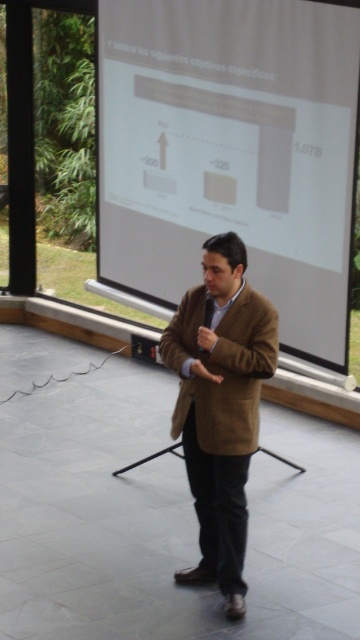
Question: Does white matte projection screen at center have a lesser width compared to brown woolen coat at center?

Choices:
 (A) yes
 (B) no

Answer: (B)

Question: Which of the following is the farthest from the observer?

Choices:
 (A) (249, 324)
 (B) (240, 378)
 (C) (198, 115)

Answer: (C)

Question: Is brown woolen coat at center positioned before brown woolen jacket at center?

Choices:
 (A) yes
 (B) no

Answer: (A)

Question: Can you confirm if white matte projection screen at center is positioned above brown woolen jacket at center?

Choices:
 (A) no
 (B) yes

Answer: (B)

Question: Which point is closer to the camera?

Choices:
 (A) white matte projection screen at center
 (B) brown woolen coat at center
 (C) brown woolen jacket at center

Answer: (B)

Question: Among these objects, which one is nearest to the camera?

Choices:
 (A) white matte projection screen at center
 (B) brown woolen jacket at center

Answer: (B)